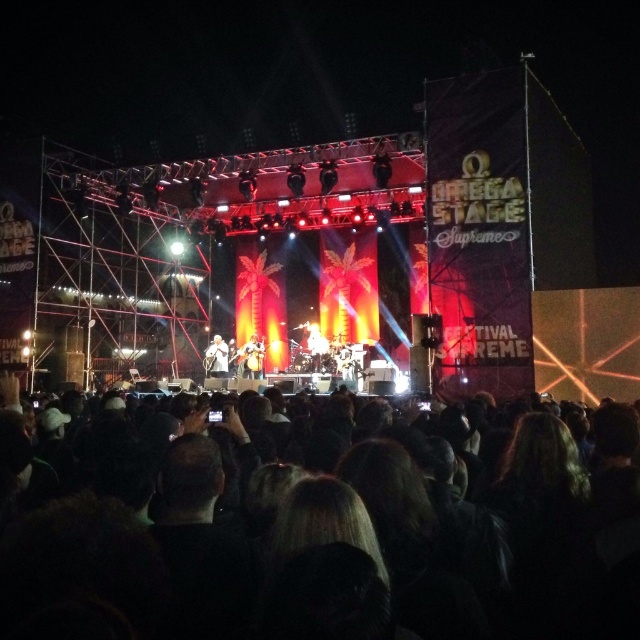
Question: Which point is closer to the camera?

Choices:
 (A) black hair at lower center
 (B) smooth skin face at center
 (C) matte black guitar at center

Answer: (A)

Question: Does black hair at lower center come behind matte black guitar at center?

Choices:
 (A) yes
 (B) no

Answer: (B)

Question: Can you confirm if black hair at lower center is positioned to the right of smooth skin face at center?

Choices:
 (A) no
 (B) yes

Answer: (B)

Question: Is matte black guitar at center above smooth skin face at center?

Choices:
 (A) yes
 (B) no

Answer: (A)

Question: Which object is positioned closest to the black hair at lower center?

Choices:
 (A) smooth skin face at center
 (B) matte black guitar at center

Answer: (B)

Question: Which is farther from the black hair at lower center?

Choices:
 (A) smooth skin face at center
 (B) matte black guitar at center

Answer: (A)